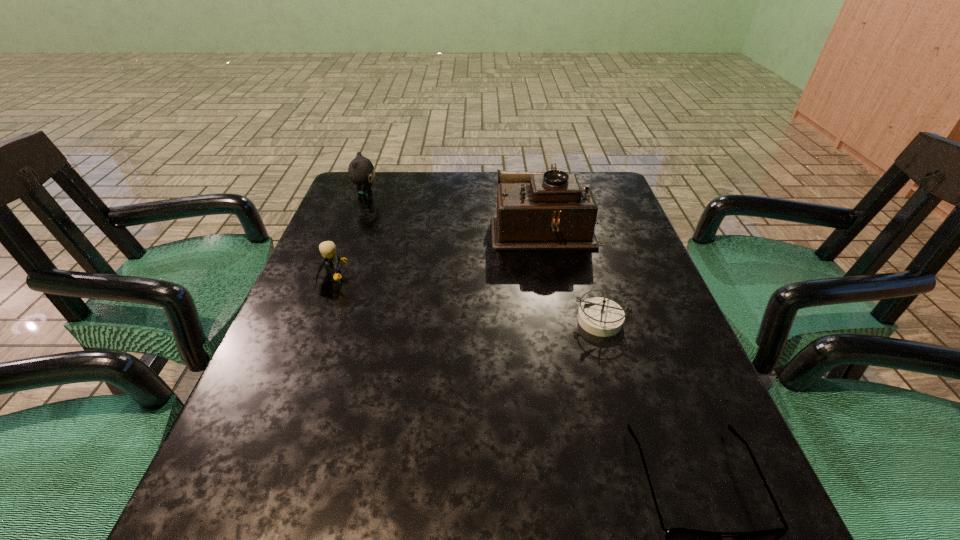
Image resolution: width=960 pixels, height=540 pixels. What are the coordinates of `the closest object to the nearest object` in the screenshot? It's located at (599, 316).

Select which object is the third closest to the Lego. Please provide its 2D coordinates. Your answer should be formatted as a tuple, i.e. [(x, y)], where the tuple contains the x and y coordinates of a point satisfying the conditions above.

[(599, 316)]

What are the coordinates of `free location that satisfies the following two spatial constraints: 1. on the front-facing side of the kitten; 2. on the back side of the compass` in the screenshot? It's located at (322, 319).

I want to click on free spot that satisfies the following two spatial constraints: 1. on the horn of the fourth farthest object; 2. on the left side of the tallest object, so click(564, 319).

Where is `vacant space that satisfies the following two spatial constraints: 1. on the front-facing side of the kitten; 2. on the back side of the fourth farthest object`? This screenshot has width=960, height=540. vacant space that satisfies the following two spatial constraints: 1. on the front-facing side of the kitten; 2. on the back side of the fourth farthest object is located at coordinates (322, 319).

You are a GUI agent. You are given a task and a screenshot of the screen. Output one action in this format:
    pyautogui.click(x=<x>, y=<y>)
    Task: Click on the free location that satisfies the following two spatial constraints: 1. on the front-facing side of the fourth shortest object; 2. on the left side of the compass
    This screenshot has height=540, width=960.
    Given the screenshot: What is the action you would take?
    pyautogui.click(x=322, y=319)